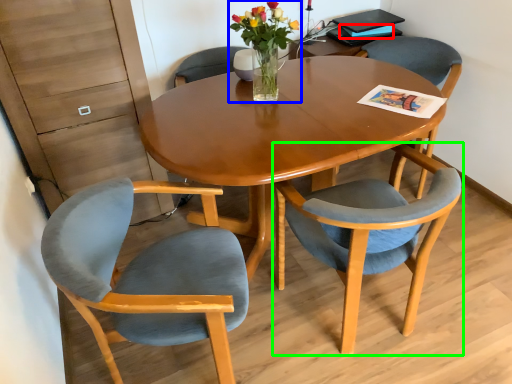
Question: Which is nearer to the magazine (highlighted by a red box)? floral arrangement (highlighted by a blue box) or chair (highlighted by a green box).

Choices:
 (A) floral arrangement
 (B) chair

Answer: (A)